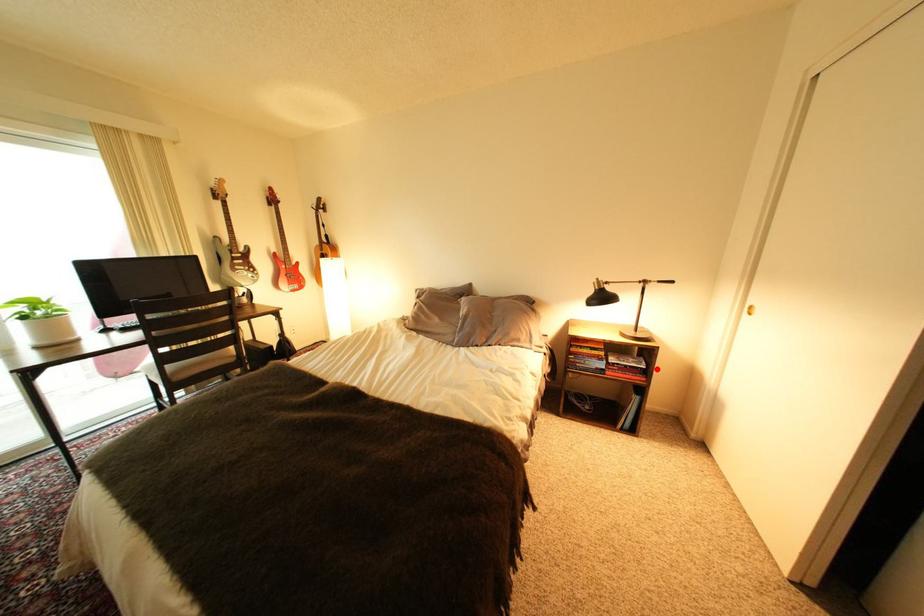
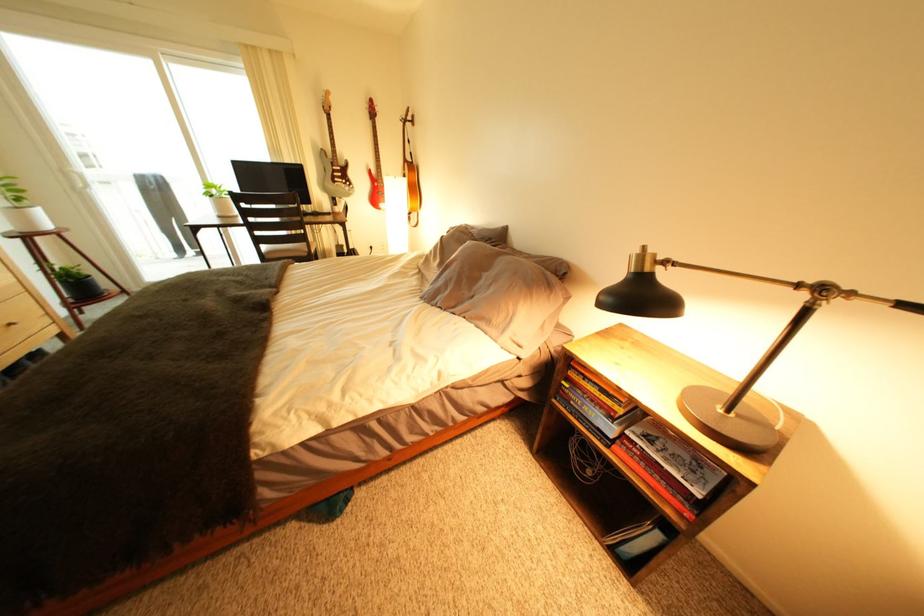
In the second image, find the point that corresponds to the highlighted location in the first image.

(712, 496)